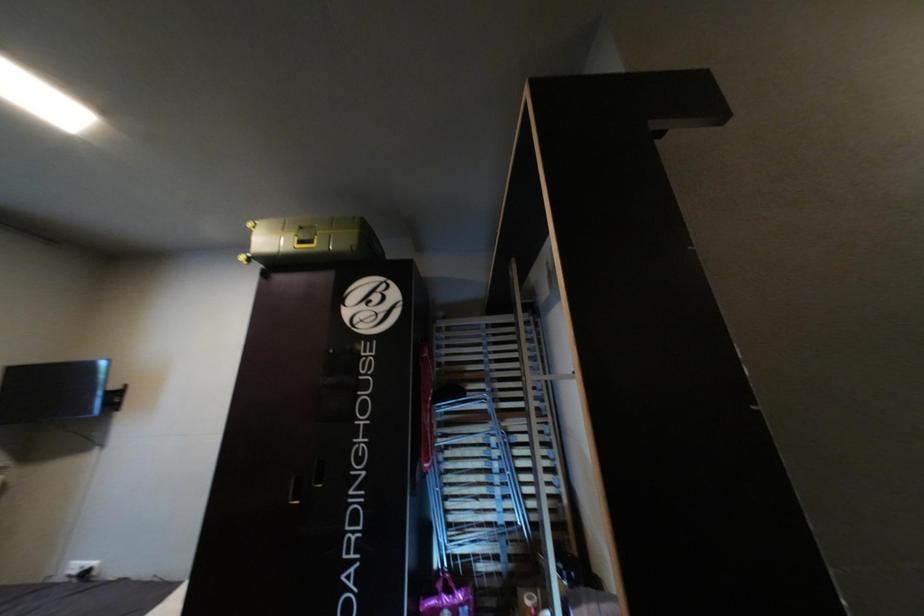
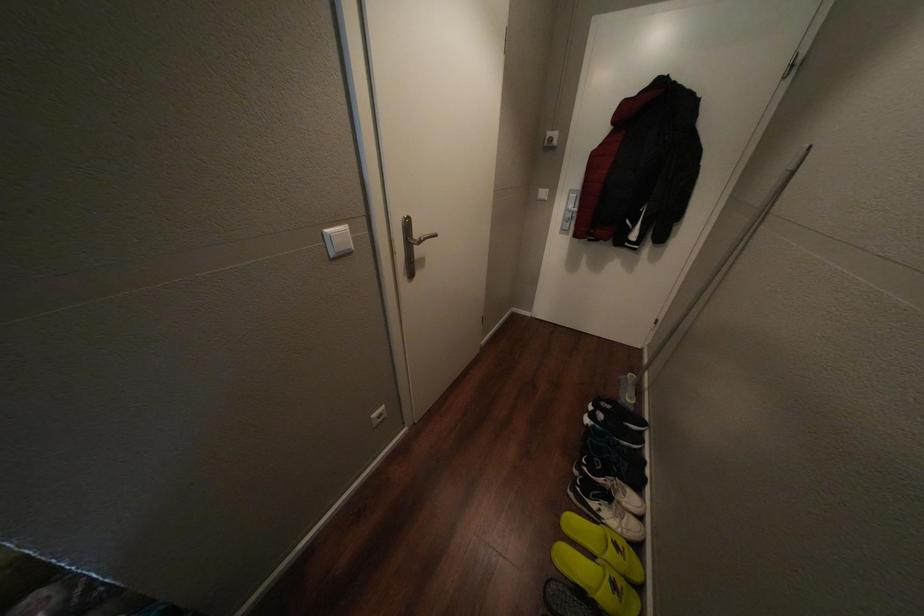
The first image is from the beginning of the video and the second image is from the end. How did the camera likely rotate when shooting the video?

The rotation direction of the camera is right-down.